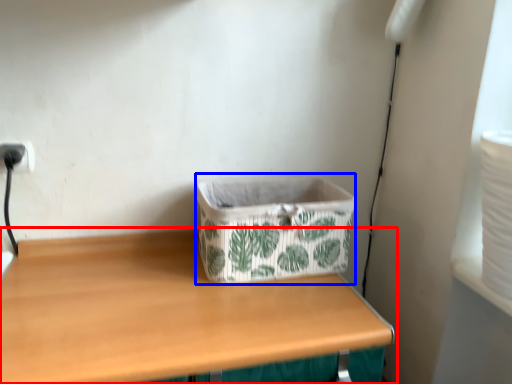
Question: Which of the following is the closest to the observer, table (highlighted by a red box) or storage box (highlighted by a blue box)?

Choices:
 (A) table
 (B) storage box

Answer: (A)